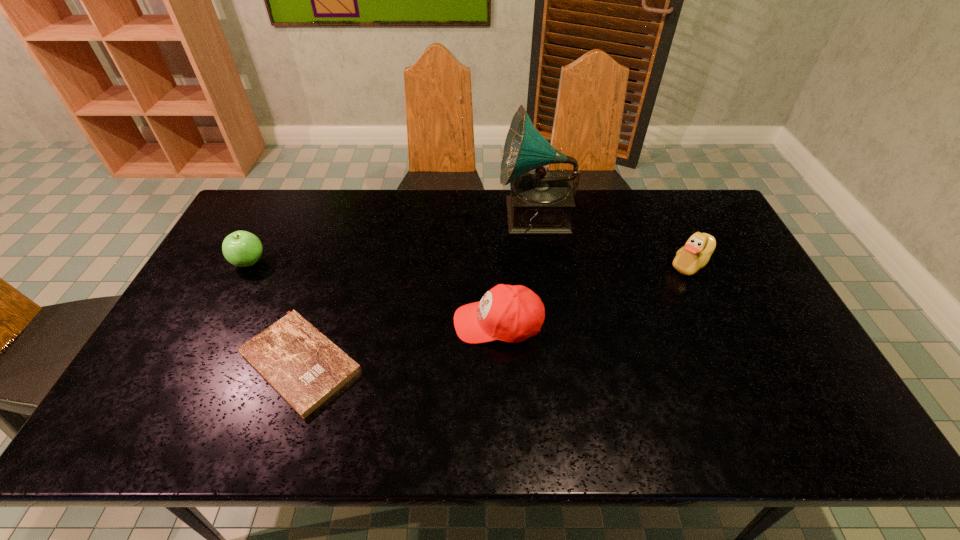
The height and width of the screenshot is (540, 960). In order to click on blank region between the baseball cap and the farthest object in this screenshot , I will do `click(516, 271)`.

You are a GUI agent. You are given a task and a screenshot of the screen. Output one action in this format:
    pyautogui.click(x=<x>, y=<y>)
    Task: Click on the free space that is in between the leftmost object and the baseball cap
    The width and height of the screenshot is (960, 540).
    Given the screenshot: What is the action you would take?
    pyautogui.click(x=373, y=293)

Where is `free space between the record player and the apple`? The height and width of the screenshot is (540, 960). free space between the record player and the apple is located at coordinates (393, 240).

At what (x,y) coordinates should I click in order to perform the action: click on blank region between the farthest object and the Bible. Please return your answer as a coordinate pair (x, y). Looking at the image, I should click on (418, 290).

The height and width of the screenshot is (540, 960). I want to click on vacant area that lies between the tallest object and the duck, so click(x=613, y=241).

Where is `vacant point located between the fourth object from right to left and the leftmost object`? The width and height of the screenshot is (960, 540). vacant point located between the fourth object from right to left and the leftmost object is located at coordinates (275, 312).

Where is `the fourth closest object to the leftmost object`? The height and width of the screenshot is (540, 960). the fourth closest object to the leftmost object is located at coordinates [696, 253].

The height and width of the screenshot is (540, 960). Find the location of `object that is the third closest to the baseball cap`. object that is the third closest to the baseball cap is located at coordinates (696, 253).